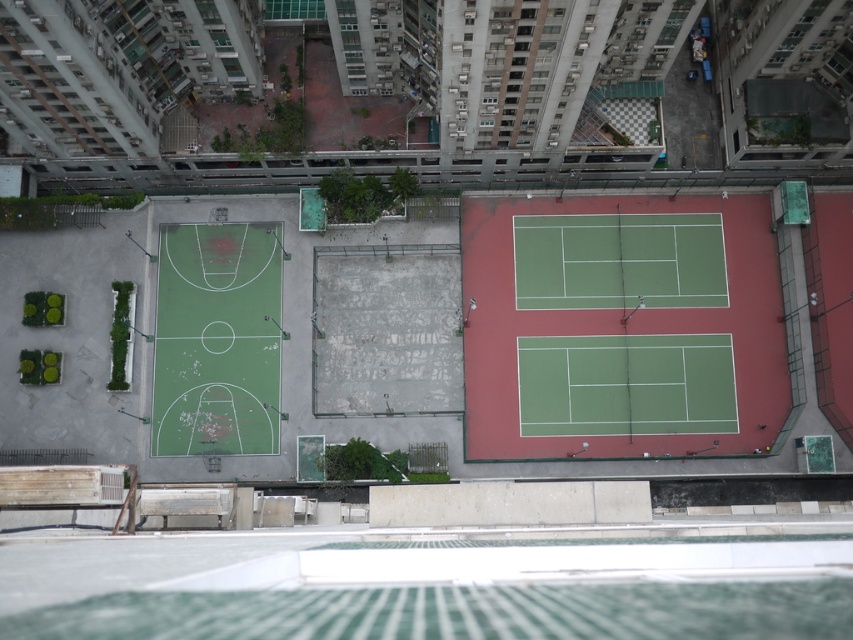
Question: Which object is closer to the camera taking this photo?

Choices:
 (A) green rubber basketball court at center
 (B) matte green tennis racket at center

Answer: (B)

Question: In this image, where is green rubber basketball court at center located relative to matte green tennis racket at center?

Choices:
 (A) left
 (B) right

Answer: (A)

Question: Where is green rubber basketball court at center located in relation to matte green tennis racket at center in the image?

Choices:
 (A) left
 (B) right

Answer: (A)

Question: Where is green rubber basketball court at center located in relation to matte green tennis racket at center in the image?

Choices:
 (A) above
 (B) below

Answer: (A)